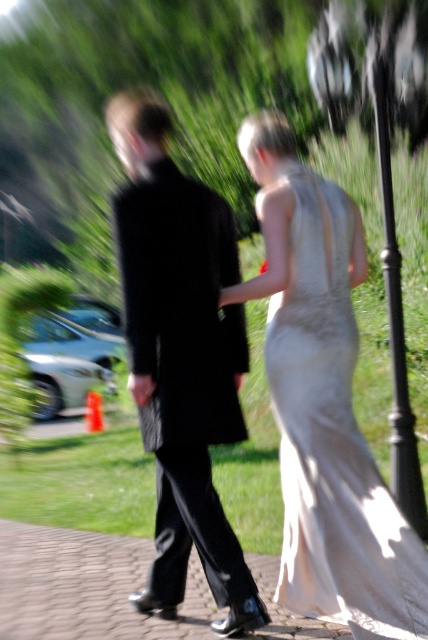
Between black velvet suit at center and paved stone walkway at center, which one is positioned higher?

black velvet suit at center is higher up.

Between black velvet suit at center and paved stone walkway at center, which one has less height?

paved stone walkway at center is shorter.

Does point (246, 611) come closer to viewer compared to point (130, 576)?

Yes, point (246, 611) is closer to viewer.

Locate an element on the screen. This screenshot has height=640, width=428. black velvet suit at center is located at coordinates point(181,356).

Between ivory satin dress at center and paved stone walkway at center, which one appears on the right side from the viewer's perspective?

ivory satin dress at center is more to the right.

Can you confirm if ivory satin dress at center is thinner than paved stone walkway at center?

Yes, ivory satin dress at center is thinner than paved stone walkway at center.

This screenshot has width=428, height=640. I want to click on ivory satin dress at center, so click(332, 440).

Is point (174, 211) positioned after point (282, 596)?

No, (174, 211) is closer to viewer.

Based on the photo, can you confirm if black velvet suit at center is shorter than ivory satin dress at center?

No.

Who is more forward, (133,390) or (308,468)?

Point (133,390)

The image size is (428, 640). I want to click on black velvet suit at center, so click(181, 356).